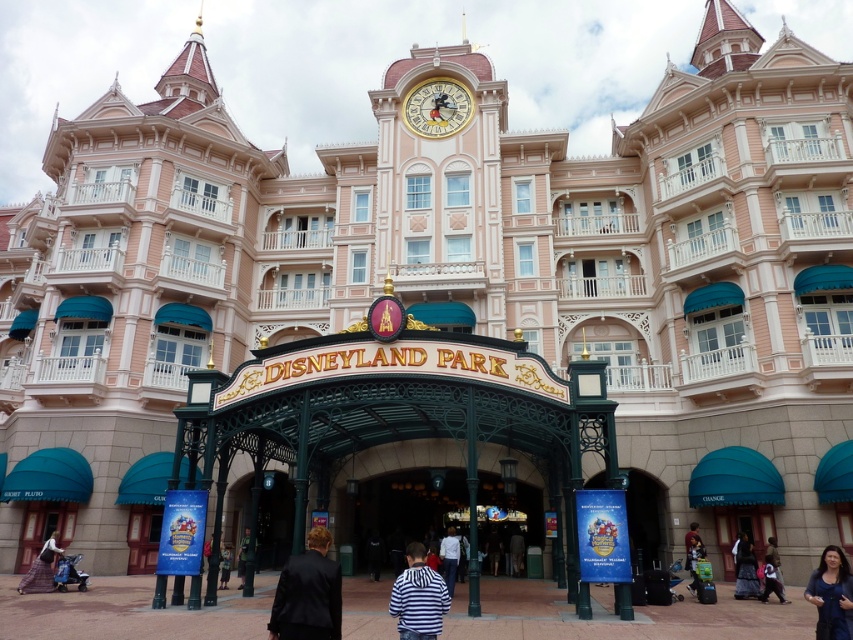
Is dark green uniform at center wider than light brown leather jacket at lower center?

Yes.

Measure the distance between dark green uniform at center and light brown leather jacket at lower center.

A distance of 1.67 meters exists between dark green uniform at center and light brown leather jacket at lower center.

What do you see at coordinates (242, 557) in the screenshot? I see `dark green uniform at center` at bounding box center [242, 557].

The height and width of the screenshot is (640, 853). Identify the location of dark green uniform at center. (242, 557).

Who is lower down, white cotton shirt at center or dark blue fabric pants at lower right?

Positioned lower is white cotton shirt at center.

Between point (448, 548) and point (764, 582), which one is positioned behind?

Point (448, 548)

Who is more forward, (450,545) or (770,572)?

Point (770,572) is in front.

Find the location of a particular element. white cotton shirt at center is located at coordinates (450, 557).

Between blue satin dress at lower right and dark green uniform at center, which one appears on the left side from the viewer's perspective?

From the viewer's perspective, dark green uniform at center appears more on the left side.

Can you confirm if blue satin dress at lower right is positioned below dark green uniform at center?

Actually, blue satin dress at lower right is above dark green uniform at center.

In order to click on blue satin dress at lower right in this screenshot , I will do `click(833, 592)`.

At what (x,y) coordinates should I click in order to perform the action: click on blue satin dress at lower right. Please return your answer as a coordinate pair (x, y). The width and height of the screenshot is (853, 640). Looking at the image, I should click on (833, 592).